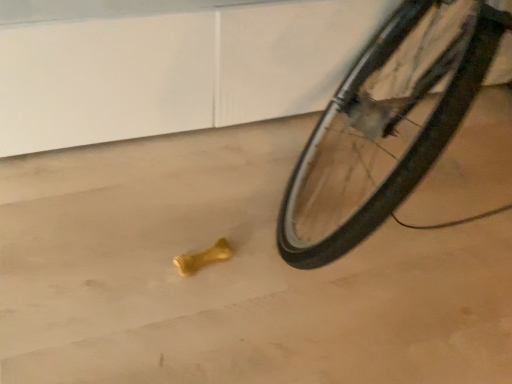
I want to click on vacant space situated on the left part of black rubber bicycle wheel at lower right, so click(x=142, y=233).